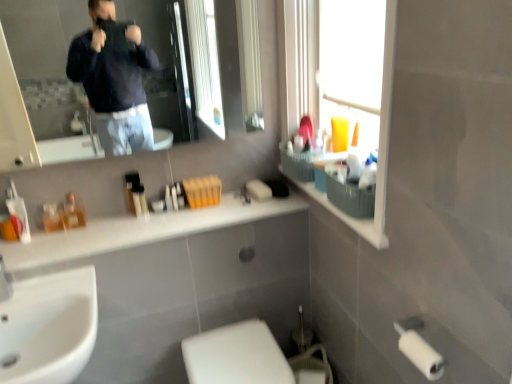
What do you see at coordinates (352, 52) in the screenshot?
I see `transparent plastic window screen at upper right` at bounding box center [352, 52].

Locate an element on the screen. This screenshot has width=512, height=384. translucent glass perfume at center, the second toiletry positioned from the left is located at coordinates point(73,212).

At what (x,y) coordinates should I click in order to perform the action: click on white glossy sink at lower left. Please return your answer as a coordinate pair (x, y). Looking at the image, I should click on (49, 327).

You are a GUI agent. You are given a task and a screenshot of the screen. Output one action in this format:
    pyautogui.click(x=<x>, y=<y>)
    Task: Click on the translucent plastic tubes at center, which is counted as the 1th toiletry, starting from the right
    Image resolution: width=512 pixels, height=384 pixels.
    Given the screenshot: What is the action you would take?
    pyautogui.click(x=135, y=193)

This screenshot has height=384, width=512. What are the coordinates of `brushed metal faucet at lower left` in the screenshot? It's located at (5, 282).

Looking at this image, which object is more forward, translucent glass perfume at center, the second toiletry positioned from the left, or white glossy sink at lower left?

Positioned in front is white glossy sink at lower left.

Considering the sizes of objects translucent glass perfume at center, the 2th toiletry viewed from the right, and white glossy sink at lower left in the image provided, who is bigger, translucent glass perfume at center, the 2th toiletry viewed from the right, or white glossy sink at lower left?

white glossy sink at lower left is bigger.

In the scene shown: Does translucent glass perfume at center, the second toiletry positioned from the left, appear on the left side of white glossy sink at lower left?

Correct, you'll find translucent glass perfume at center, the second toiletry positioned from the left, to the left of white glossy sink at lower left.

Which point is more forward, (79, 223) or (67, 355)?

The point (67, 355) is closer.

Can you tell me how much white glossy counter top at center and translucent plastic tubes at center, which is counted as the 1th toiletry, starting from the right, differ in facing direction?

white glossy counter top at center and translucent plastic tubes at center, which is counted as the 1th toiletry, starting from the right, are facing 1.19 degrees away from each other.

From the image's perspective, is white glossy counter top at center located beneath translucent plastic tubes at center, which is counted as the 1th toiletry, starting from the right?

Yes, from the image's perspective, white glossy counter top at center is below translucent plastic tubes at center, which is counted as the 1th toiletry, starting from the right.

Is white glossy counter top at center to the left of translucent plastic tubes at center, which is counted as the 1th toiletry, starting from the right, from the viewer's perspective?

No.

Is white glossy counter top at center shorter than translucent plastic tubes at center, which is counted as the 1th toiletry, starting from the right?

Yes, white glossy counter top at center is shorter than translucent plastic tubes at center, which is counted as the 1th toiletry, starting from the right.

Is point (376, 233) closer to camera compared to point (129, 208)?

Yes, point (376, 233) is in front of point (129, 208).

Is the depth of translucent plastic basket at upper right less than that of translucent plastic tubes at center, marked as the third toiletry in a left-to-right arrangement?

Yes, the depth of translucent plastic basket at upper right is less than that of translucent plastic tubes at center, marked as the third toiletry in a left-to-right arrangement.

Is translucent plastic basket at upper right facing away from translucent plastic tubes at center, which is counted as the 1th toiletry, starting from the right?

No, translucent plastic basket at upper right is not facing the opposite direction of translucent plastic tubes at center, which is counted as the 1th toiletry, starting from the right.

Can we say translucent plastic basket at upper right lies outside translucent plastic tubes at center, which is counted as the 1th toiletry, starting from the right?

Absolutely, translucent plastic basket at upper right is external to translucent plastic tubes at center, which is counted as the 1th toiletry, starting from the right.

I want to click on faucet on the left of translucent plastic bottles at left, the third toiletry in the right-to-left sequence, so click(5, 282).

From the image's perspective, relative to brushed metal faucet at lower left, is translucent plastic bottles at left, the third toiletry in the right-to-left sequence, above or below?

Based on their image positions, translucent plastic bottles at left, the third toiletry in the right-to-left sequence, is located above brushed metal faucet at lower left.

Is translucent plastic bottles at left, the third toiletry in the right-to-left sequence, positioned beyond the bounds of brushed metal faucet at lower left?

Yes, translucent plastic bottles at left, the third toiletry in the right-to-left sequence, is located beyond the bounds of brushed metal faucet at lower left.

Which object is closer to the camera, translucent plastic bottles at left, which appears as the 1th toiletry when viewed from the left, or brushed metal faucet at lower left?

brushed metal faucet at lower left is in front.

From a real-world perspective, is translucent plastic tubes at center, marked as the third toiletry in a left-to-right arrangement, positioned above or below brushed metal faucet at lower left?

Clearly, from a real-world perspective, translucent plastic tubes at center, marked as the third toiletry in a left-to-right arrangement, is above brushed metal faucet at lower left.

Consider the image. Measure the distance from translucent plastic tubes at center, which is counted as the 1th toiletry, starting from the right, to brushed metal faucet at lower left.

translucent plastic tubes at center, which is counted as the 1th toiletry, starting from the right, and brushed metal faucet at lower left are 20.58 inches apart from each other.

Is translucent plastic tubes at center, marked as the third toiletry in a left-to-right arrangement, aimed at brushed metal faucet at lower left?

No, translucent plastic tubes at center, marked as the third toiletry in a left-to-right arrangement, is not aimed at brushed metal faucet at lower left.

Is translucent plastic tubes at center, marked as the third toiletry in a left-to-right arrangement, positioned far away from brushed metal faucet at lower left?

No, there isn't a large distance between translucent plastic tubes at center, marked as the third toiletry in a left-to-right arrangement, and brushed metal faucet at lower left.

Is point (263, 199) positioned after point (288, 208)?

Yes, it is.

How many degrees apart are the facing directions of white matte soap at center and white glossy counter top at center?

1.19 degrees.

Looking at this image, which is behind, white matte soap at center or white glossy counter top at center?

white matte soap at center is behind.

Image resolution: width=512 pixels, height=384 pixels. In order to click on soap above the white glossy counter top at center (from the image's perspective) in this screenshot , I will do `click(259, 190)`.

In terms of height, does white matte soap at center look taller or shorter compared to translucent plastic basket at upper right?

Considering their sizes, white matte soap at center has less height than translucent plastic basket at upper right.

Is point (263, 190) closer or farther from the camera than point (378, 195)?

Point (263, 190) appears to be farther away from the viewer than point (378, 195).

Is white matte soap at center bigger than translucent plastic basket at upper right?

Incorrect, white matte soap at center is not larger than translucent plastic basket at upper right.

From a real-world perspective, which toiletry is the 2nd one above the white glossy sink at lower left? Please provide its 2D coordinates.

[(73, 212)]

Image resolution: width=512 pixels, height=384 pixels. Find the location of `counter top below the translucent plastic tubes at center, marked as the third toiletry in a left-to-right arrangement (from a real-world perspective)`. counter top below the translucent plastic tubes at center, marked as the third toiletry in a left-to-right arrangement (from a real-world perspective) is located at coordinates (138, 231).

Looking at the image, which one is located closer to white glossy sink at lower left, translucent plastic bottles at left, the third toiletry in the right-to-left sequence, or translucent plastic basket at upper right?

translucent plastic bottles at left, the third toiletry in the right-to-left sequence, is closer to white glossy sink at lower left.

When comparing their distances from white matte soap at center, does translucent plastic tubes at center, which is counted as the 1th toiletry, starting from the right, or white glossy sink at lower left seem closer?

translucent plastic tubes at center, which is counted as the 1th toiletry, starting from the right, is closer to white matte soap at center.

Estimate the real-world distances between objects in this image. Which object is closer to translucent plastic bottles at left, the third toiletry in the right-to-left sequence, translucent plastic basket at upper right or transparent plastic window screen at upper right?

Based on the image, translucent plastic basket at upper right appears to be nearer to translucent plastic bottles at left, the third toiletry in the right-to-left sequence.

From the picture: Considering their positions, is white glossy toilet at lower center positioned closer to translucent plastic bottles at left, the third toiletry in the right-to-left sequence, than white glossy counter top at center?

white glossy counter top at center lies closer to translucent plastic bottles at left, the third toiletry in the right-to-left sequence, than the other object.

Looking at the image, which one is located further to white matte soap at center, white glossy sink at lower left or brushed metal faucet at lower left?

Among the two, brushed metal faucet at lower left is located further to white matte soap at center.

Considering their positions, is brushed metal faucet at lower left positioned closer to translucent glass perfume at center, the second toiletry positioned from the left, than translucent plastic basket at upper right?

brushed metal faucet at lower left lies closer to translucent glass perfume at center, the second toiletry positioned from the left, than the other object.

Looking at the image, which one is located further to white matte soap at center, brushed metal faucet at lower left or white glossy sink at lower left?

Among the two, brushed metal faucet at lower left is located further to white matte soap at center.

From the image, which object appears to be nearer to transparent plastic window screen at upper right, translucent glass perfume at center, the second toiletry positioned from the left, or white matte soap at center?

white matte soap at center is closer to transparent plastic window screen at upper right.

The image size is (512, 384). I want to click on sink between brushed metal faucet at lower left and white matte soap at center in the horizontal direction, so click(x=49, y=327).

Image resolution: width=512 pixels, height=384 pixels. I want to click on counter top that lies between translucent glass perfume at center, the 2th toiletry viewed from the right, and white glossy toilet at lower center from top to bottom, so click(x=138, y=231).

Identify the location of soap between translucent plastic tubes at center, which is counted as the 1th toiletry, starting from the right, and transparent plastic window screen at upper right, in the horizontal direction. The width and height of the screenshot is (512, 384). (259, 190).

Find the location of a particular element. sink between white matte soap at center and white glossy toilet at lower center from top to bottom is located at coordinates [x=49, y=327].